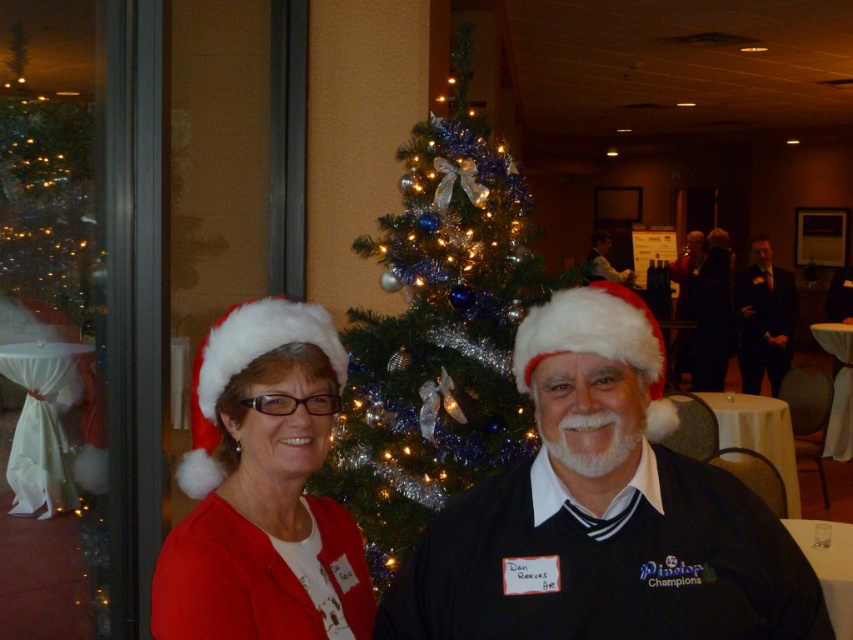
You are a photographer standing 10 feet away from the white fluffy Santa hat at left. You want to take a photo of the dark suit at center without moving your camera. Can you do it?

The distance between the white fluffy Santa hat at left and the dark suit at center is 24.57 feet. Since you are already 10 feet away from the Santa hat, the dark suit at center is 14.57 feet away from you. As long as your camera can focus at that distance, you can take the photo without moving.

You are a photographer setting up a camera at the back of the room. You want to take a picture of both the shiny blue and silver ornaments at center and the white fluffy santa hat at left. Since you want both objects to be in focus, you need to know which one is taller. Can you tell me which one is taller?

The shiny blue and silver ornaments at center is taller than the white fluffy santa hat at left.